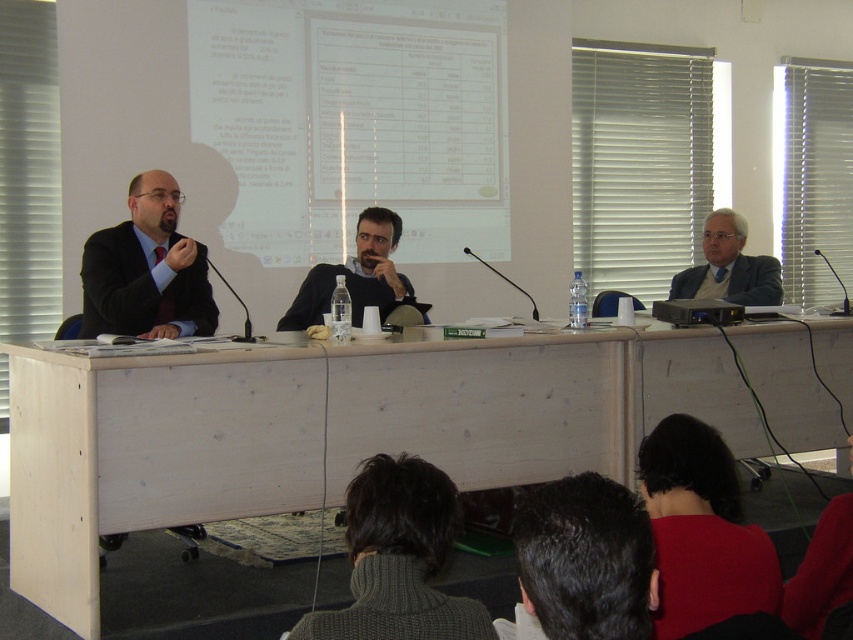
How much distance is there between light wood table at center and dark brown hair at lower center?

6.08 feet

Who is more forward, (779, 346) or (592, 552)?

Point (592, 552) is more forward.

You are a GUI agent. You are given a task and a screenshot of the screen. Output one action in this format:
    pyautogui.click(x=<x>, y=<y>)
    Task: Click on the light wood table at center
    The width and height of the screenshot is (853, 640).
    Given the screenshot: What is the action you would take?
    pyautogui.click(x=326, y=429)

Who is lower down, light wood table at center or dark red sweater at lower right?

dark red sweater at lower right is below.

Is light wood table at center bigger than dark red sweater at lower right?

Correct, light wood table at center is larger in size than dark red sweater at lower right.

Which is behind, point (86, 522) or point (691, 512)?

Positioned behind is point (86, 522).

You are a GUI agent. You are given a task and a screenshot of the screen. Output one action in this format:
    pyautogui.click(x=<x>, y=<y>)
    Task: Click on the light wood table at center
    The width and height of the screenshot is (853, 640).
    Given the screenshot: What is the action you would take?
    pyautogui.click(x=326, y=429)

Is light wood table at center closer to camera compared to white shirt at right?

Yes, light wood table at center is closer to the viewer.

Can you confirm if light wood table at center is smaller than white shirt at right?

No.

Who is more distant from viewer, (83, 372) or (767, 289)?

The point (767, 289) is more distant.

The image size is (853, 640). Identify the location of light wood table at center. (326, 429).